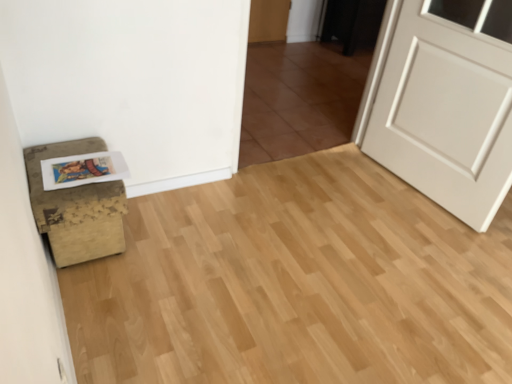
Question: Is matte paper postcard at lower left bigger or smaller than brown tile at center?

Choices:
 (A) big
 (B) small

Answer: (B)

Question: In terms of width, does matte paper postcard at lower left look wider or thinner when compared to brown tile at center?

Choices:
 (A) wide
 (B) thin

Answer: (A)

Question: Which object is the farthest from the distressed brown ottoman at lower left?

Choices:
 (A) white matte door at right
 (B) matte paper postcard at lower left
 (C) brown tile at center

Answer: (A)

Question: Based on their relative distances, which object is nearer to the brown tile at center?

Choices:
 (A) white matte door at right
 (B) distressed brown ottoman at lower left
 (C) matte paper postcard at lower left

Answer: (A)